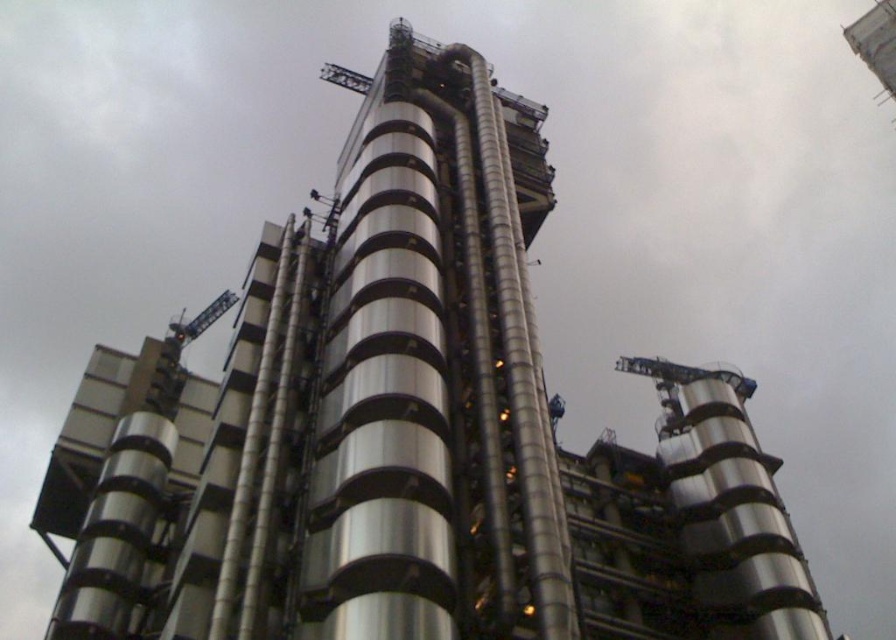
You are standing at the center of the square in front of the iconic Lloyd building. You want to take a photo of the metallic silver tower at center. Where should you position yourself to capture the tower in the frame?

The metallic silver tower at center is located at point coordinates of (x=431, y=380), so you should position yourself at the center of the square to capture the tower in the frame.

You are an architect evaluating the structural integrity of the metallic silver tower at center and the metallic gray crane at upper left. Which structure has a greater height?

The metallic silver tower at center has a greater height compared to the metallic gray crane at upper left.